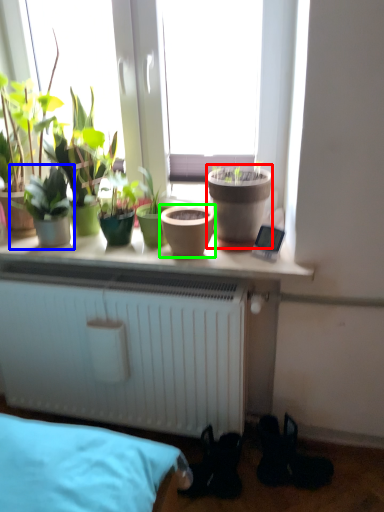
Question: Which is nearer to the flowerpot (highlighted by a red box)? houseplant (highlighted by a blue box) or flowerpot (highlighted by a green box).

Choices:
 (A) houseplant
 (B) flowerpot

Answer: (B)